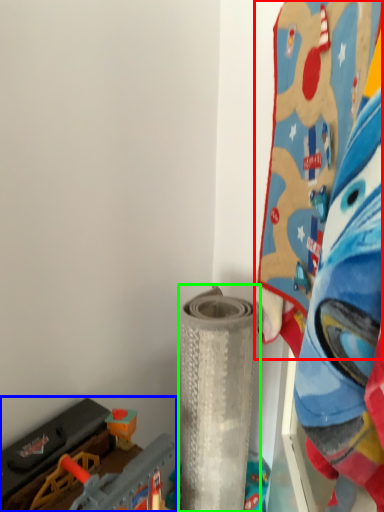
Question: Considering the real-world distances, which object is farthest from toy (highlighted by a red box)? toy (highlighted by a blue box) or toy (highlighted by a green box)?

Choices:
 (A) toy
 (B) toy

Answer: (A)